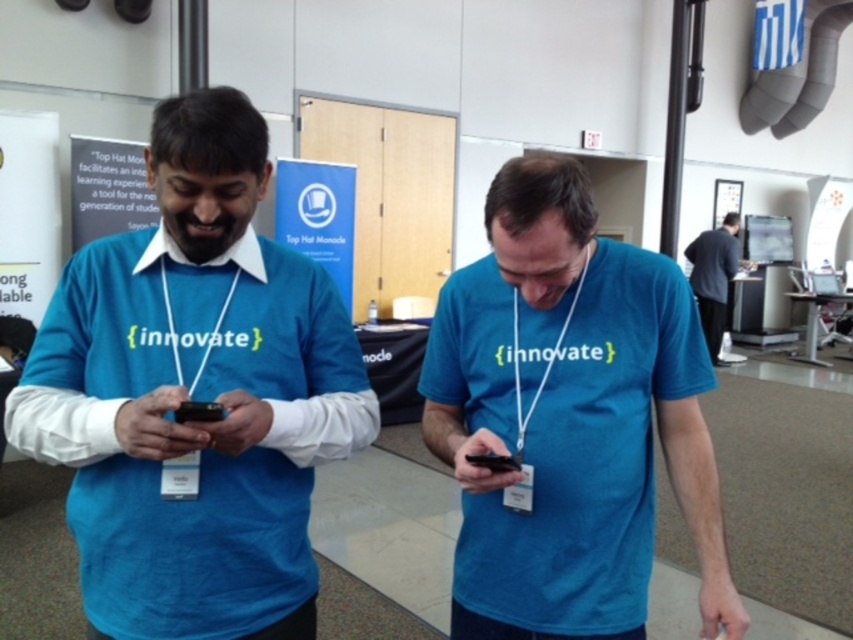
Who is more distant from viewer, (88, 189) or (721, 332)?

The point (721, 332) is more distant.

Is point (120, 211) positioned before point (715, 356)?

Yes.

Is point (77, 172) farther from viewer compared to point (717, 320)?

No, (77, 172) is in front of (717, 320).

Identify the location of matte white text at upper left. The image size is (853, 640). (108, 188).

Does blue matte shirt at center have a greater height compared to black matte smartphone at center?

Yes, blue matte shirt at center is taller than black matte smartphone at center.

Who is higher up, blue matte shirt at center or black matte smartphone at center?

black matte smartphone at center is above.

Describe the element at coordinates (569, 419) in the screenshot. The height and width of the screenshot is (640, 853). I see `blue matte shirt at center` at that location.

At what (x,y) coordinates should I click in order to perform the action: click on blue matte shirt at center. Please return your answer as a coordinate pair (x, y). Looking at the image, I should click on (569, 419).

From the picture: Who is lower down, matte blue shirt at left or blue matte shirt at center?

Positioned lower is blue matte shirt at center.

Is point (198, 561) behind point (496, 333)?

No.

You are a GUI agent. You are given a task and a screenshot of the screen. Output one action in this format:
    pyautogui.click(x=<x>, y=<y>)
    Task: Click on the matte blue shirt at left
    Image resolution: width=853 pixels, height=640 pixels.
    Given the screenshot: What is the action you would take?
    pyautogui.click(x=194, y=396)